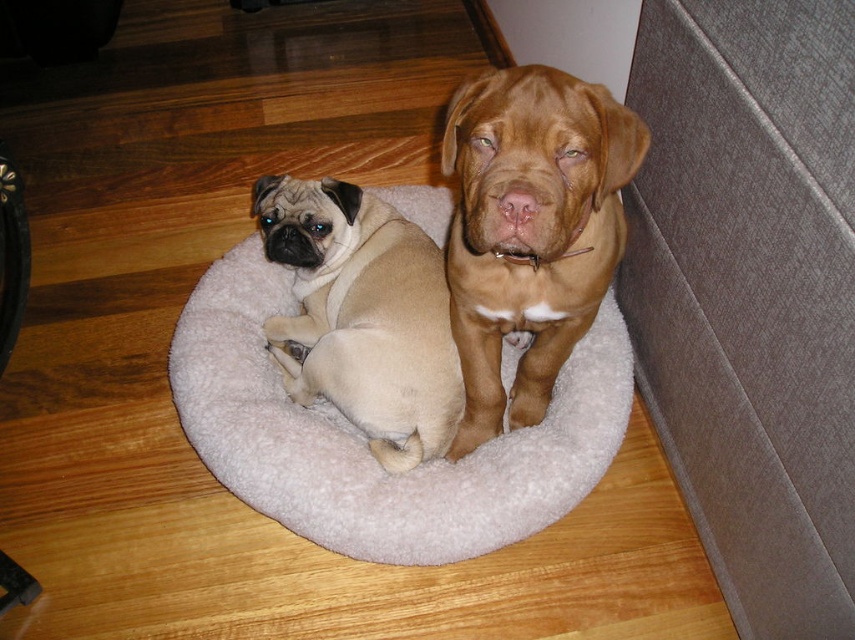
You are a dog owner who wants to place a new beige fur pug at center on the white fluffy dog bed at center. Based on the scene description, can the pug fit on the bed?

The white fluffy dog bed at center might be wider than beige fur pug at center, so there is a possibility that the pug can fit on the bed. However, the exact dimensions are not provided, so it is recommended to check the bed size before placing the pug.

From the picture: You are a dog owner who wants to ensure the two dogs can comfortably rest without touching each other. Given that the white fluffy dog bed at center is 12.26 inches away from the brown smooth dog at center, can both dogs fit on the bed without overlapping?

The white fluffy dog bed at center is 12.26 inches away from the brown smooth dog at center, so there is enough space between them for both dogs to rest comfortably without overlapping.

You are standing in front of the two dogs resting on the circular dog bed. You want to throw a treat to the closest point between the two points marked as point 1 at point [517,502] and point 2 at point [376,445]. Which point should you aim for to ensure the treat lands closer to both dogs?

Point 1 at point [517,502] is closer to the viewer than point 2 at point [376,445]. Therefore, to ensure the treat lands closer to both dogs, you should aim for point 1 at point [517,502].